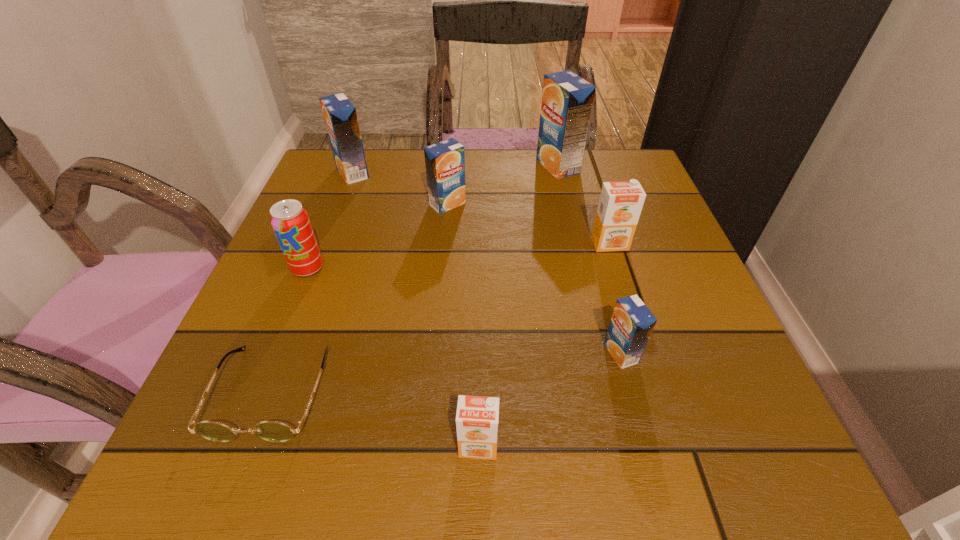
Where is `the fifth farthest orange juice`? the fifth farthest orange juice is located at coordinates (631, 325).

I want to click on the fourth object from right to left, so click(477, 417).

This screenshot has height=540, width=960. In order to click on the third orange juice from left to right in this screenshot , I will do `click(477, 417)`.

Locate an element on the screen. The width and height of the screenshot is (960, 540). green spectacles is located at coordinates (273, 431).

Locate an element on the screen. spectacles is located at coordinates (273, 431).

Find the location of `free space located 0.070m on the left of the tallest orange juice`. free space located 0.070m on the left of the tallest orange juice is located at coordinates coord(510,166).

What are the coordinates of `free location located on the front of the leftmost blue orange_juice` in the screenshot? It's located at (337, 215).

Where is `vacant space positioned on the left of the second orange juice from left to right`? The height and width of the screenshot is (540, 960). vacant space positioned on the left of the second orange juice from left to right is located at coordinates (359, 204).

Where is `vacant region located 0.060m on the back of the fourth farthest orange juice`? Image resolution: width=960 pixels, height=540 pixels. vacant region located 0.060m on the back of the fourth farthest orange juice is located at coordinates (602, 219).

Identify the location of free spot located on the right of the soda can. Image resolution: width=960 pixels, height=540 pixels. (427, 268).